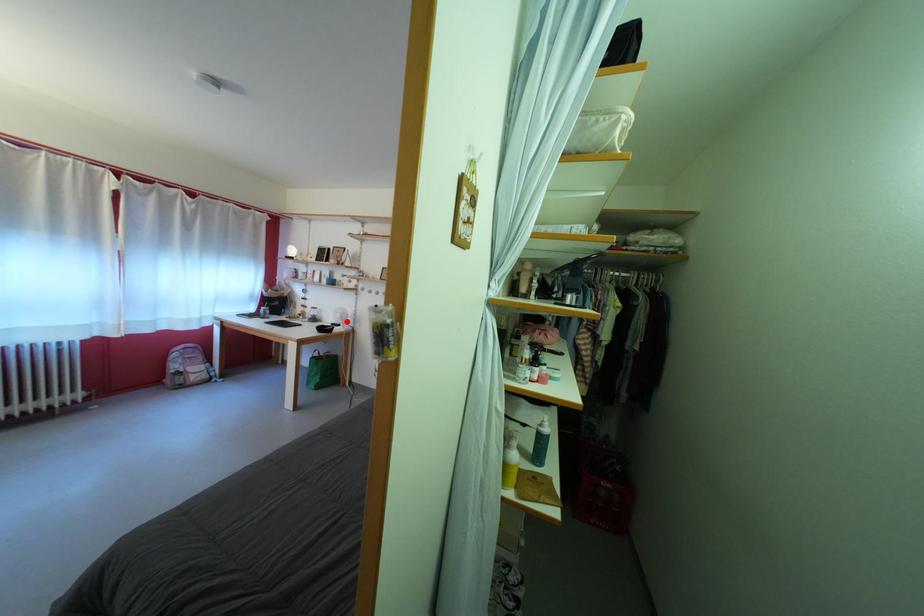
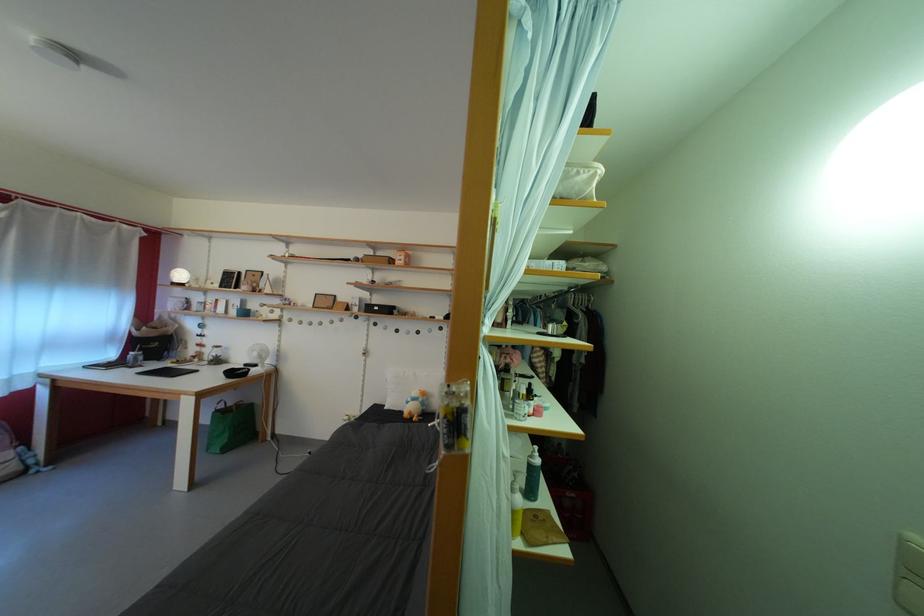
Locate, in the second image, the point that corresponds to the highlighted location in the first image.

(263, 360)